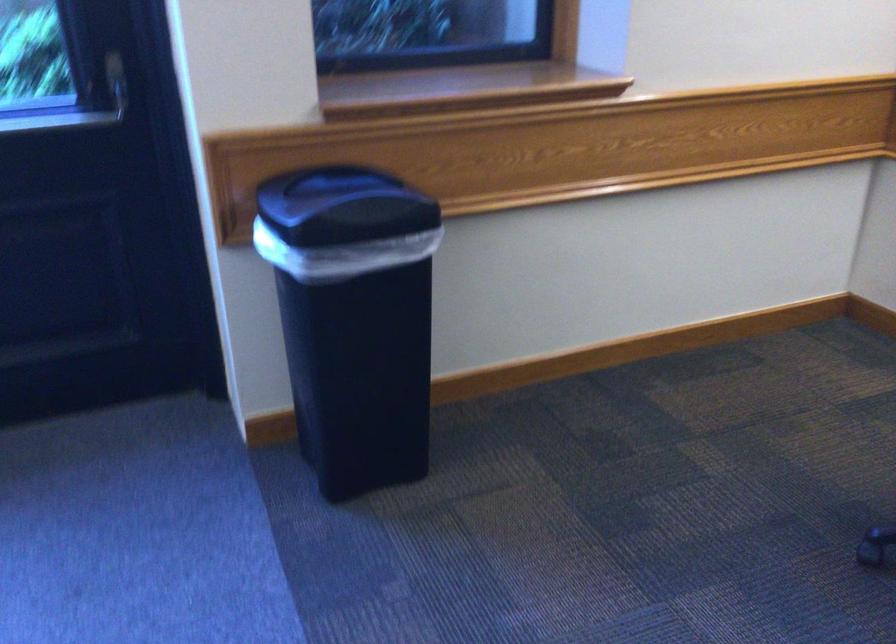
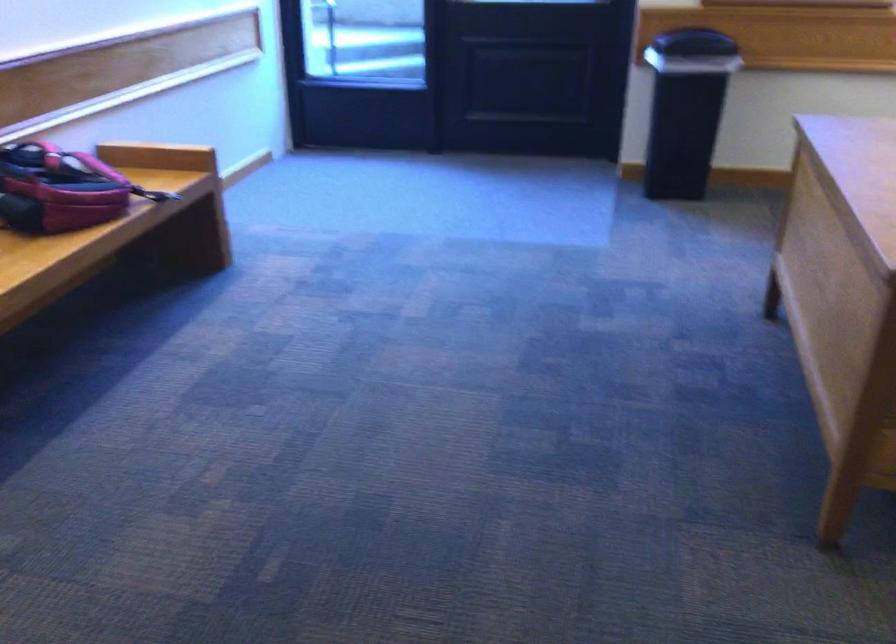
The point at (389, 243) is marked in the first image. Where is the corresponding point in the second image?

(694, 43)